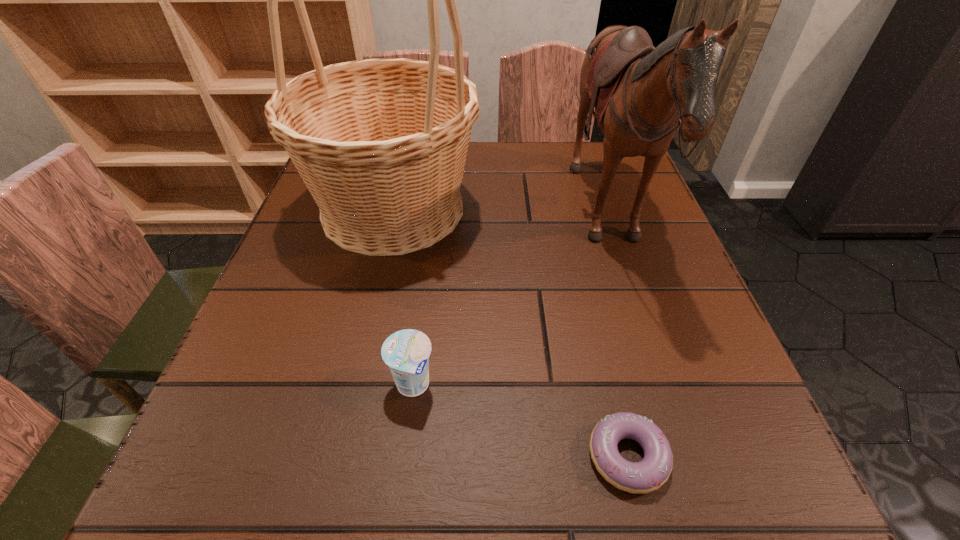
Identify the location of object present at the near right corner. This screenshot has width=960, height=540. (649, 474).

At what (x,y) coordinates should I click in order to perform the action: click on free space at the left edge. Please return your answer as a coordinate pair (x, y). Image resolution: width=960 pixels, height=540 pixels. Looking at the image, I should click on (264, 365).

At what (x,y) coordinates should I click in order to perform the action: click on free location at the right edge of the desktop. Please return your answer as a coordinate pair (x, y). The height and width of the screenshot is (540, 960). Looking at the image, I should click on (608, 252).

In the image, there is a desktop. Where is `vacant space at the near left corner`? This screenshot has width=960, height=540. vacant space at the near left corner is located at coordinates (280, 482).

This screenshot has width=960, height=540. I want to click on blank space at the far right corner of the desktop, so click(x=604, y=151).

At what (x,y) coordinates should I click in order to perform the action: click on empty space between the yogurt and the nearest object. Please return your answer as a coordinate pair (x, y). Looking at the image, I should click on (520, 421).

Find the location of a particular element. The width and height of the screenshot is (960, 540). free space that is in between the tallest object and the third tallest object is located at coordinates (403, 297).

Identify the location of vacant area between the basket and the yogurt. (403, 297).

Where is `empty space between the second tallest object and the nearest object`? The width and height of the screenshot is (960, 540). empty space between the second tallest object and the nearest object is located at coordinates (617, 338).

Find the location of a particular element. This screenshot has height=540, width=960. blank region between the doughnut and the saddle is located at coordinates (617, 338).